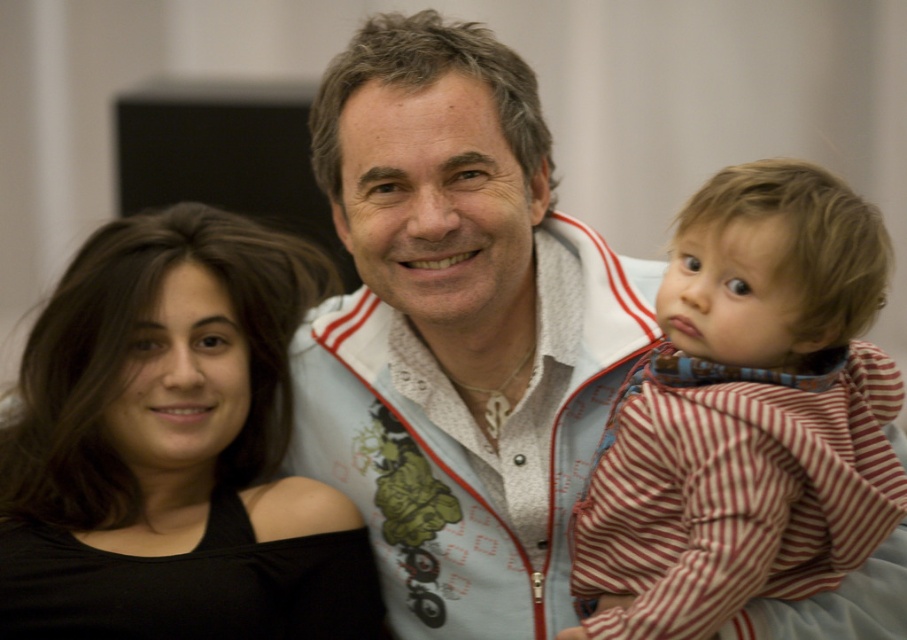
In the scene described, there are two clothing items present. The first is a white textured jacket at center, and the second is a striped cotton shirt at right. Considering their positions and the context of the family moment, which clothing item is taller?

The white textured jacket at center is taller than the striped cotton shirt at right.

You are a photographer trying to capture the central figure wearing the white textured jacket at center in the image. Based on the coordinates provided, where should you focus your camera to ensure the jacket is centered in the frame?

The white textured jacket at center is located at point coordinates (456, 330), so focusing the camera at those coordinates will center the jacket in the frame.

You are a photographer trying to capture a group photo of the family members. The two adults are wearing a white textured jacket at center and a striped cotton shirt at right. If you want to ensure both clothing items are clearly visible in the frame, what should you consider about their distance?

The white textured jacket at center and striped cotton shirt at right are 11.09 inches apart, so you should ensure the camera is positioned close enough to capture both items within the frame while maintaining clarity.